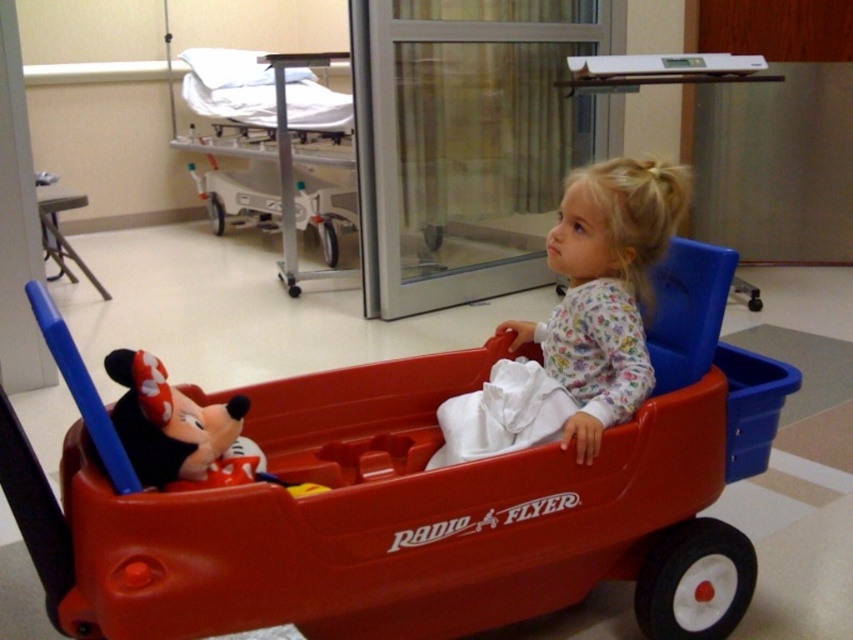
Question: Which point appears farthest from the camera in this image?

Choices:
 (A) (198, 456)
 (B) (291, 404)
 (C) (267, 147)

Answer: (C)

Question: Which object is the farthest from the white fabric hospital bed at upper center?

Choices:
 (A) matte plush mickey mouse at lower left
 (B) matte plastic wagon at center

Answer: (A)

Question: Which point appears farthest from the camera in this image?

Choices:
 (A) (334, 243)
 (B) (442, 568)

Answer: (A)

Question: Is white fabric hospital bed at upper center further to the viewer compared to matte plush mickey mouse at lower left?

Choices:
 (A) no
 (B) yes

Answer: (B)

Question: Can you confirm if matte plastic wagon at center is bigger than white fabric hospital bed at upper center?

Choices:
 (A) no
 (B) yes

Answer: (A)

Question: Does white fabric hospital bed at upper center appear on the left side of matte plush mickey mouse at lower left?

Choices:
 (A) yes
 (B) no

Answer: (A)